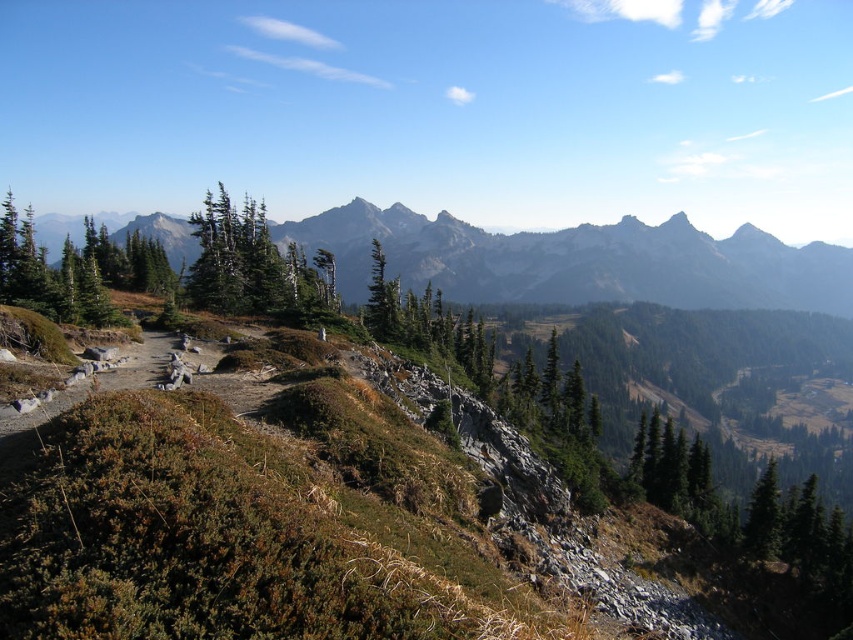
You are a hiker looking at the mountain landscape. You see a green matte tree at upper left and a green matte tree at center. Which tree is positioned more to the left side of the image?

The green matte tree at upper left is positioned more to the left side of the image compared to the green matte tree at center.

You are standing at the point marked by the coordinates point [254,266] in the mountainous landscape. What object are you directly at?

The point [254,266] corresponds to the green matte tree at upper left.

You are a hiker planning to take a photo of the gray rocky mountains at center and the green matte tree at upper left. Which object should you position closer to the camera to ensure both are in focus?

You should position the gray rocky mountains at center closer to the camera because the green matte tree at upper left is behind them, so bringing the mountains forward will help both be in focus.